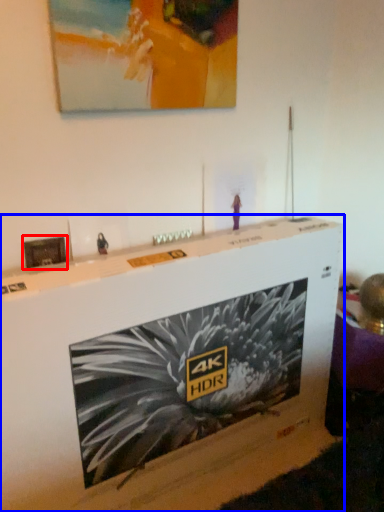
Question: Among these objects, which one is farthest to the camera, picture frame (highlighted by a red box) or furniture (highlighted by a blue box)?

Choices:
 (A) picture frame
 (B) furniture

Answer: (A)